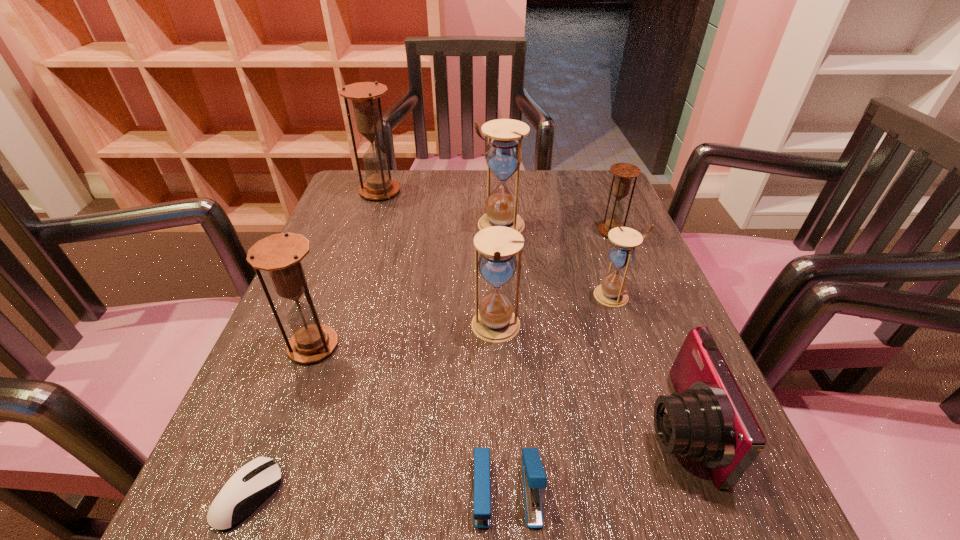
You are a GUI agent. You are given a task and a screenshot of the screen. Output one action in this format:
    pyautogui.click(x=<x>, y=<y>)
    Task: Click on the vacant area situated on the front-facing side of the seventh tallest object
    The image size is (960, 540).
    Given the screenshot: What is the action you would take?
    pyautogui.click(x=381, y=426)

The height and width of the screenshot is (540, 960). In order to click on vacant space located 0.330m on the front-facing side of the seventh tallest object in this screenshot , I will do `click(422, 426)`.

Locate an element on the screen. The width and height of the screenshot is (960, 540). vacant space situated 0.290m on the back of the stapler is located at coordinates (498, 309).

Locate an element on the screen. The height and width of the screenshot is (540, 960). vacant space located 0.060m on the right of the mouse is located at coordinates (324, 495).

In order to click on camera that is positioned at the near edge in this screenshot , I will do `click(708, 419)`.

This screenshot has width=960, height=540. I want to click on stapler positioned at the near edge, so click(534, 478).

This screenshot has width=960, height=540. Identify the location of mouse that is positioned at the near edge. (255, 481).

I want to click on mouse that is positioned at the left edge, so click(x=255, y=481).

Locate an element on the screen. camera that is positioned at the right edge is located at coordinates tap(708, 419).

Locate an element on the screen. Image resolution: width=960 pixels, height=540 pixels. object present at the far left corner is located at coordinates (365, 96).